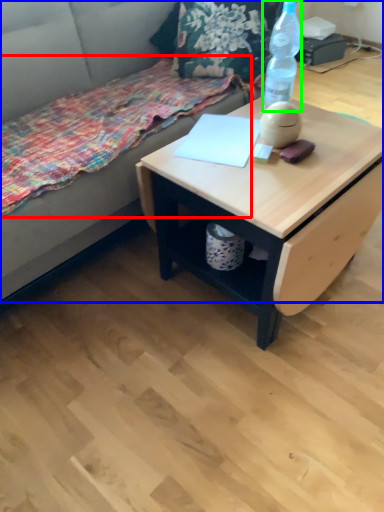
Question: Estimate the real-world distances between objects in this image. Which object is closer to blanket (highlighted by a red box), studio couch (highlighted by a blue box) or bottle (highlighted by a green box)?

Choices:
 (A) studio couch
 (B) bottle

Answer: (A)